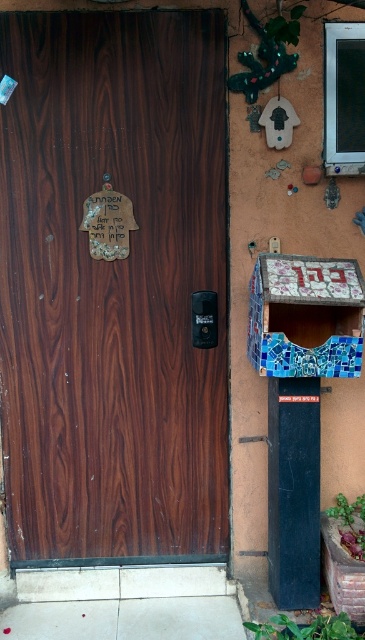
You are a delivery person trying to deliver a package to the brown wood door at center. The black plastic phone box at center is blocking the path. Can you walk through the space between them?

The brown wood door at center is wider than the black plastic phone box at center, so there is enough space between them for you to walk through.

You are standing in front of the brown wood door at center. What are the coordinates of the door?

The coordinates of the brown wood door at center are at point (113, 285).

You are a delivery person needing to place a package on the mosaic tile bulletin board at right and the black plastic phone box at center. Which surface is closer to the wall painted in earthy orange?

The mosaic tile bulletin board at right is closer to the wall painted in earthy orange because it is positioned to the right of the black plastic phone box at center, which is further from the wall.